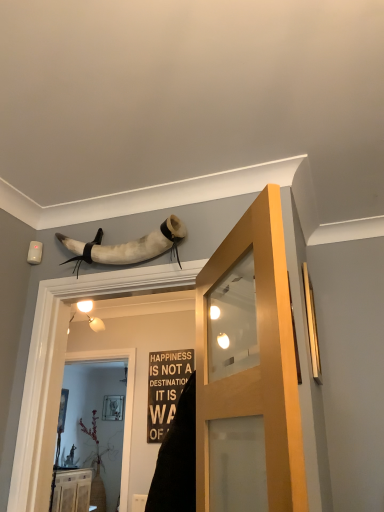
The height and width of the screenshot is (512, 384). What do you see at coordinates (125, 404) in the screenshot? I see `translucent glass screen door at center` at bounding box center [125, 404].

Locate an element on the screen. The height and width of the screenshot is (512, 384). translucent glass screen door at center is located at coordinates (125, 404).

What do you see at coordinates (311, 325) in the screenshot? I see `gold metallic window at right` at bounding box center [311, 325].

Identify the location of translucent glass screen door at center. The width and height of the screenshot is (384, 512). (125, 404).

Does point (288, 350) come behind point (87, 254)?

No, (288, 350) is closer to viewer.

Can you confirm if matte wood door at center is positioned to the left of white leather horn at upper center?

Incorrect, matte wood door at center is not on the left side of white leather horn at upper center.

From the image's perspective, is matte wood door at center located above or below white leather horn at upper center?

Clearly, from the image's perspective, matte wood door at center is below white leather horn at upper center.

Consider the image. From a real-world perspective, which object stands above the other?

In real-world perspective, white leather horn at upper center is above.

Is light brown wood cabinet at lower left positioned with its back to translucent glass screen door at center?

Answer: light brown wood cabinet at lower left is not turned away from translucent glass screen door at center.

Considering the sizes of objects light brown wood cabinet at lower left and translucent glass screen door at center in the image provided, who is bigger, light brown wood cabinet at lower left or translucent glass screen door at center?

Bigger between the two is light brown wood cabinet at lower left.

Between light brown wood cabinet at lower left and translucent glass screen door at center, which one appears on the left side from the viewer's perspective?

light brown wood cabinet at lower left.

You are a GUI agent. You are given a task and a screenshot of the screen. Output one action in this format:
    pyautogui.click(x=<x>, y=<y>)
    Task: Click on the screen door above the light brown wood cabinet at lower left (from the image's perspective)
    Image resolution: width=384 pixels, height=512 pixels.
    Given the screenshot: What is the action you would take?
    pyautogui.click(x=125, y=404)

Is translucent glass screen door at center beside white leather horn at upper center?

translucent glass screen door at center and white leather horn at upper center are not in contact.

Is white leather horn at upper center completely or partially inside translucent glass screen door at center?

No.

Based on the photo, is translucent glass screen door at center facing towards white leather horn at upper center?

No, translucent glass screen door at center is not aimed at white leather horn at upper center.

Between translucent glass screen door at center and white leather horn at upper center, which one has larger size?

translucent glass screen door at center is bigger.

Which object is further away from the camera, white leather horn at upper center or translucent glass screen door at center?

translucent glass screen door at center is further from the camera.

How far apart are white leather horn at upper center and translucent glass screen door at center?

6.63 feet.

Where is `animal above the translucent glass screen door at center (from the image's perspective)`? The width and height of the screenshot is (384, 512). animal above the translucent glass screen door at center (from the image's perspective) is located at coordinates (128, 246).

Which is closer to the camera, (x=168, y=236) or (x=125, y=456)?

Point (x=168, y=236) is positioned closer to the camera compared to point (x=125, y=456).

Does white leather horn at upper center have a greater height compared to matte wood door at center?

Incorrect, the height of white leather horn at upper center is not larger of that of matte wood door at center.

From the image's perspective, is white leather horn at upper center below matte wood door at center?

Actually, white leather horn at upper center appears above matte wood door at center in the image.

Can matte wood door at center be found inside white leather horn at upper center?

No.

Is white leather horn at upper center wider than matte wood door at center?

Indeed, white leather horn at upper center has a greater width compared to matte wood door at center.

Who is smaller, white leather horn at upper center or gold metallic window at right?

gold metallic window at right is smaller.

From the image's perspective, which is above, white leather horn at upper center or gold metallic window at right?

white leather horn at upper center is shown above in the image.

Are white leather horn at upper center and gold metallic window at right located far from each other?

No.

Is gold metallic window at right not inside light brown wood cabinet at lower left?

gold metallic window at right is positioned outside light brown wood cabinet at lower left.

From a real-world perspective, is gold metallic window at right below light brown wood cabinet at lower left?

Answer: No, from a real-world perspective, gold metallic window at right is not beneath light brown wood cabinet at lower left.

Could you tell me if gold metallic window at right is turned towards light brown wood cabinet at lower left?

No, gold metallic window at right is not oriented towards light brown wood cabinet at lower left.

Does gold metallic window at right have a larger size compared to light brown wood cabinet at lower left?

No, gold metallic window at right is not bigger than light brown wood cabinet at lower left.

This screenshot has height=512, width=384. What are the coordinates of `animal behind the matte wood door at center` in the screenshot? It's located at (128, 246).

In order to click on screen door above the light brown wood cabinet at lower left (from a real-world perspective) in this screenshot , I will do `click(125, 404)`.

When comparing their distances from matte wood door at center, does white leather horn at upper center or translucent glass screen door at center seem further?

translucent glass screen door at center lies further to matte wood door at center than the other object.

From the image, which object appears to be farther from translucent glass screen door at center, white leather horn at upper center or matte wood door at center?

matte wood door at center is further to translucent glass screen door at center.

Estimate the real-world distances between objects in this image. Which object is closer to white leather horn at upper center, light brown wood cabinet at lower left or translucent glass screen door at center?

Among the two, translucent glass screen door at center is located nearer to white leather horn at upper center.

From the image, which object appears to be nearer to matte wood door at center, light brown wood cabinet at lower left or gold metallic window at right?

gold metallic window at right lies closer to matte wood door at center than the other object.

When comparing their distances from matte wood door at center, does light brown wood cabinet at lower left or translucent glass screen door at center seem further?

Based on the image, light brown wood cabinet at lower left appears to be further to matte wood door at center.

Looking at the image, which one is located closer to light brown wood cabinet at lower left, matte wood door at center or white leather horn at upper center?

Among the two, white leather horn at upper center is located nearer to light brown wood cabinet at lower left.

Estimate the real-world distances between objects in this image. Which object is further from light brown wood cabinet at lower left, white leather horn at upper center or translucent glass screen door at center?

white leather horn at upper center.

Based on the photo, looking at the image, which one is located further to white leather horn at upper center, matte wood door at center or gold metallic window at right?

Among the two, gold metallic window at right is located further to white leather horn at upper center.

Locate an element on the screen. animal between matte wood door at center and light brown wood cabinet at lower left in the front-back direction is located at coordinates (128, 246).

You are a GUI agent. You are given a task and a screenshot of the screen. Output one action in this format:
    pyautogui.click(x=<x>, y=<y>)
    Task: Click on the window between matte wood door at center and white leather horn at upper center along the z-axis
    Image resolution: width=384 pixels, height=512 pixels.
    Given the screenshot: What is the action you would take?
    pyautogui.click(x=311, y=325)

Locate an element on the screen. window between matte wood door at center and translucent glass screen door at center along the z-axis is located at coordinates (311, 325).

The image size is (384, 512). Identify the location of animal between matte wood door at center and translucent glass screen door at center from front to back. (128, 246).